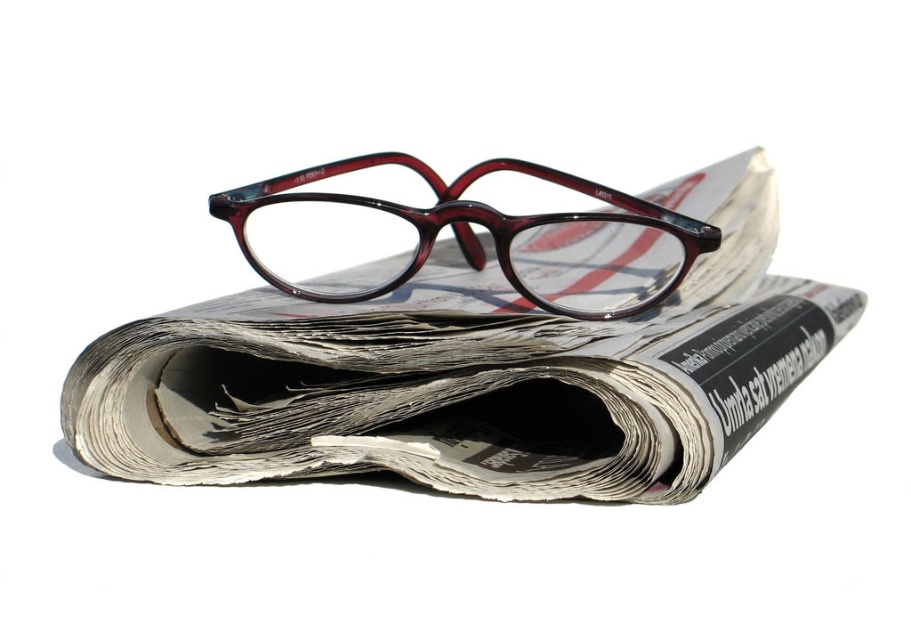
Question: Is the position of white printed newspaper at center less distant than that of translucent maroon plastic glasses at center?

Choices:
 (A) no
 (B) yes

Answer: (B)

Question: Among these points, which one is nearest to the camera?

Choices:
 (A) (343, 435)
 (B) (263, 237)

Answer: (A)

Question: Is white printed newspaper at center below translucent maroon plastic glasses at center?

Choices:
 (A) no
 (B) yes

Answer: (B)

Question: Which point is farther to the camera?

Choices:
 (A) (313, 262)
 (B) (319, 320)

Answer: (A)

Question: Is white printed newspaper at center to the right of translucent maroon plastic glasses at center from the viewer's perspective?

Choices:
 (A) no
 (B) yes

Answer: (B)